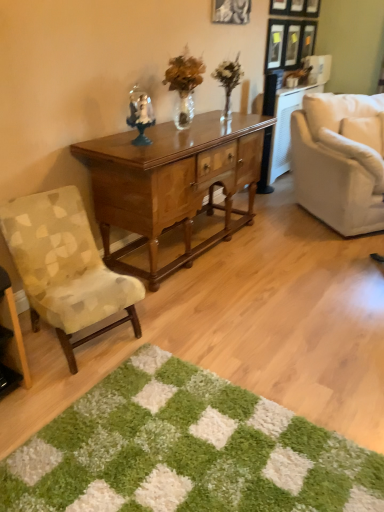
Question: Can you confirm if patterned fabric chair at left, which ranks as the second chair in top-to-bottom order, is taller than white fabric chair at right, positioned as the first chair in top-to-bottom order?

Choices:
 (A) yes
 (B) no

Answer: (B)

Question: Does patterned fabric chair at left, which is the 1th chair from front to back, have a larger size compared to white fabric chair at right, which is the first chair from right to left?

Choices:
 (A) yes
 (B) no

Answer: (B)

Question: Does patterned fabric chair at left, which appears as the second chair when viewed from the back, come behind white fabric chair at right, arranged as the 2th chair when viewed from the front?

Choices:
 (A) yes
 (B) no

Answer: (B)

Question: From the image's perspective, would you say patterned fabric chair at left, the first chair when ordered from left to right, is shown under white fabric chair at right, the second chair from the bottom?

Choices:
 (A) no
 (B) yes

Answer: (B)

Question: Does patterned fabric chair at left, which appears as the second chair when viewed from the back, have a lesser height compared to white fabric chair at right, the first chair in the back-to-front sequence?

Choices:
 (A) yes
 (B) no

Answer: (A)

Question: Could you tell me if patterned fabric chair at left, the first chair ordered from the bottom, is turned towards white fabric chair at right, arranged as the 2th chair when viewed from the front?

Choices:
 (A) no
 (B) yes

Answer: (A)

Question: Would you say black matte picture frame at upper center is outside translucent glass vase at center?

Choices:
 (A) yes
 (B) no

Answer: (A)

Question: Is black matte picture frame at upper center closer to the viewer compared to translucent glass vase at center?

Choices:
 (A) no
 (B) yes

Answer: (A)

Question: From the image's perspective, is black matte picture frame at upper center located above translucent glass vase at center?

Choices:
 (A) no
 (B) yes

Answer: (B)

Question: From the image's perspective, would you say black matte picture frame at upper center is shown under translucent glass vase at center?

Choices:
 (A) no
 (B) yes

Answer: (A)

Question: Is black matte picture frame at upper center bigger than translucent glass vase at center?

Choices:
 (A) yes
 (B) no

Answer: (B)

Question: Considering the relative sizes of black matte picture frame at upper center and translucent glass vase at center in the image provided, is black matte picture frame at upper center wider than translucent glass vase at center?

Choices:
 (A) no
 (B) yes

Answer: (A)

Question: Is black matte picture frame at upper center oriented towards polished wood desk at center?

Choices:
 (A) no
 (B) yes

Answer: (A)